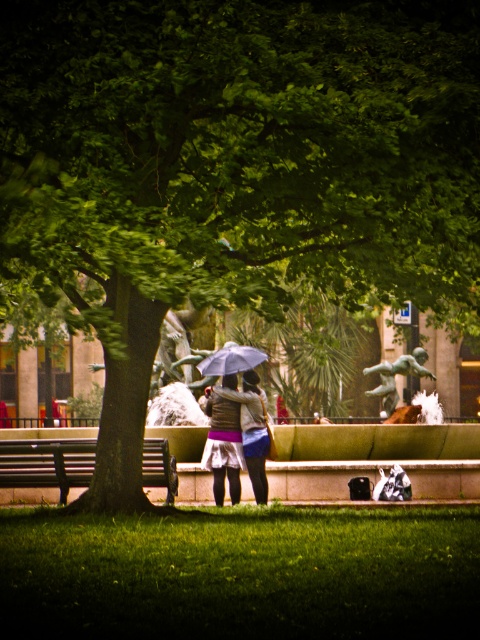
Which is in front, point (223, 636) or point (228, 400)?

Point (223, 636)

What do you see at coordinates (240, 573) in the screenshot?
I see `green grass at lower center` at bounding box center [240, 573].

Is point (96, 576) positioned behind point (266, 429)?

No, it is not.

Where is `green grass at lower center`? This screenshot has height=640, width=480. green grass at lower center is located at coordinates (240, 573).

Can you confirm if wooden bench at left is thinner than matte brown jacket at center?

Incorrect, wooden bench at left's width is not less than matte brown jacket at center's.

Is wooden bench at left to the right of matte brown jacket at center from the viewer's perspective?

Incorrect, wooden bench at left is not on the right side of matte brown jacket at center.

What are the coordinates of `wooden bench at left` in the screenshot? It's located at (47, 464).

This screenshot has width=480, height=640. In order to click on wooden bench at left in this screenshot , I will do `click(47, 464)`.

The image size is (480, 640). I want to click on green patinated bronze statue at center, so pos(396,372).